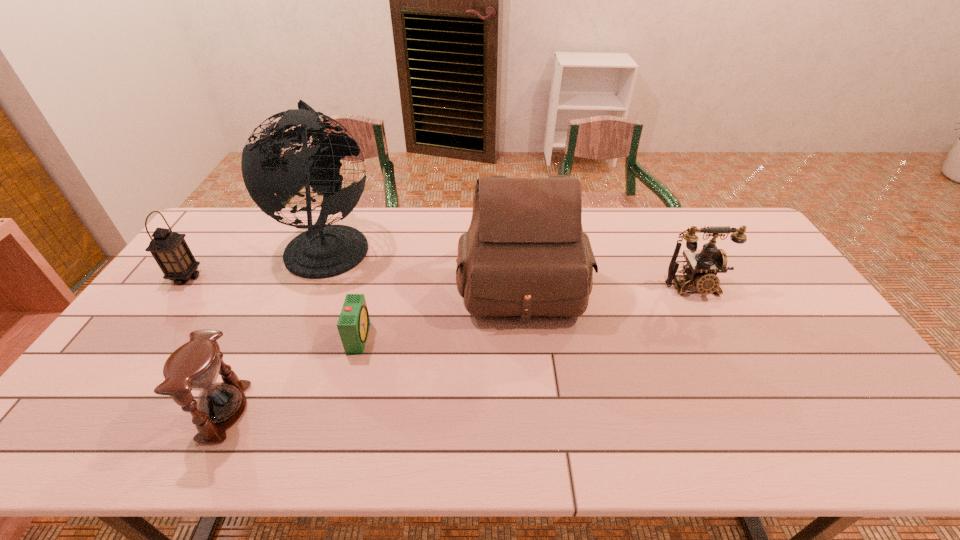
The image size is (960, 540). I want to click on free spot that satisfies the following two spatial constraints: 1. on the front-facing side of the globe; 2. on the front side of the leftmost object, so click(316, 277).

You are a GUI agent. You are given a task and a screenshot of the screen. Output one action in this format:
    pyautogui.click(x=<x>, y=<y>)
    Task: Click on the vacant position in the image that satisfies the following two spatial constraints: 1. on the front side of the leftmost object; 2. on the right side of the nearest object
    
    Given the screenshot: What is the action you would take?
    pyautogui.click(x=86, y=411)

Identify the location of vacant region that satisfies the following two spatial constraints: 1. on the front flap of the second object from right to left; 2. on the front-facing side of the shortest object. This screenshot has width=960, height=540. (527, 337).

This screenshot has height=540, width=960. Identify the location of vacant space that satisfies the following two spatial constraints: 1. on the front-facing side of the globe; 2. on the front side of the hourglass. (261, 411).